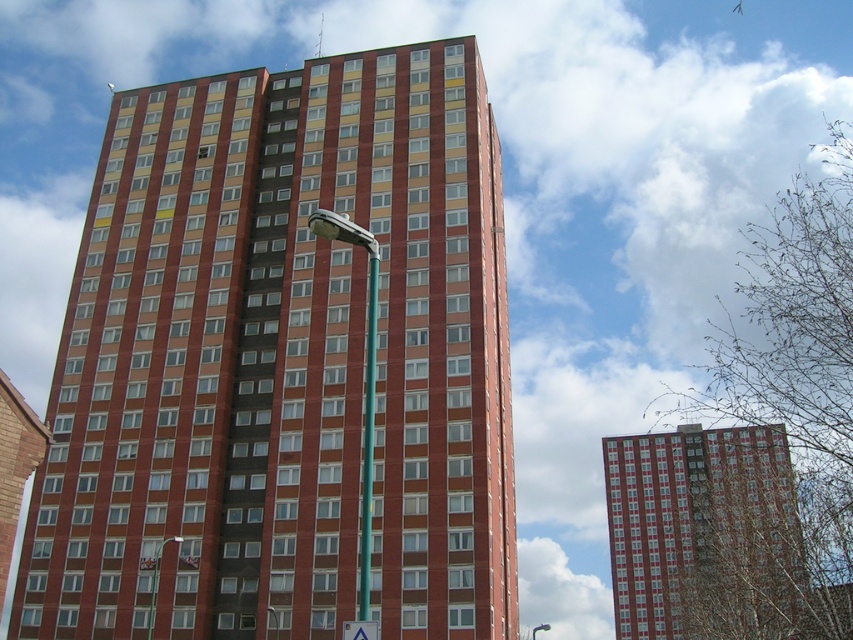
You are a city planner evaluating the urban layout. You need to determine if the white plastic triangle at center can be placed in front of the brick textured building at center without blocking the building view. Based on their sizes, is this possible?

The brick textured building at center is larger in size than the white plastic triangle at center, so placing the white plastic triangle at center in front of the brick textured building at center would not block the entire view of the building since it is smaller in size.

You are a city planner analyzing the layout of this area. You need to determine the exact coordinates of the brick textured building at center for a new public park design. What are its coordinates?

The brick textured building at center is located at point (x=283, y=364), so its coordinates are 0.569 on the x axis and 0.333 on the y axis.